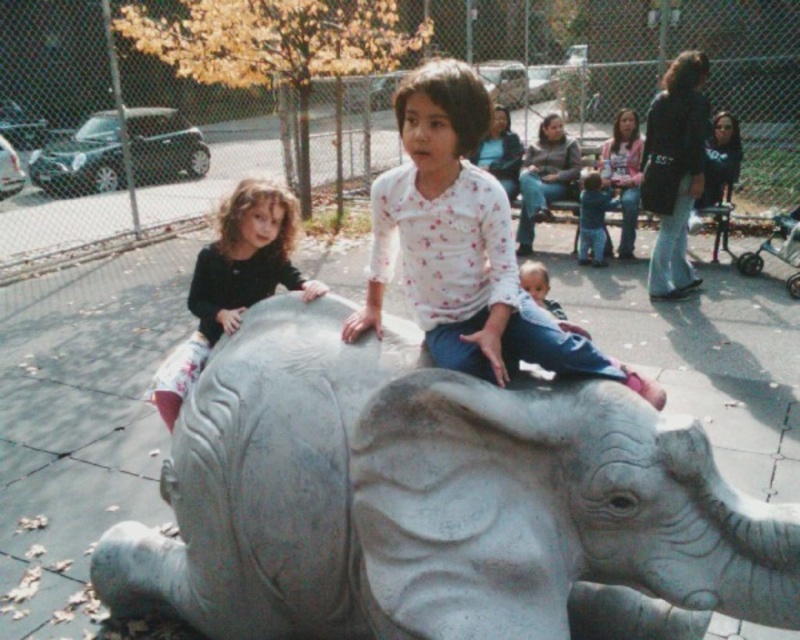
Is gray stone elephant at center below white floral shirt at center?

Yes.

In the scene shown: Can you confirm if gray stone elephant at center is shorter than white floral shirt at center?

No.

Identify the location of gray stone elephant at center. The width and height of the screenshot is (800, 640). (436, 502).

Image resolution: width=800 pixels, height=640 pixels. What do you see at coordinates (436, 502) in the screenshot? I see `gray stone elephant at center` at bounding box center [436, 502].

Can you confirm if gray stone elephant at center is shorter than dark brown hair at left?

No, gray stone elephant at center is not shorter than dark brown hair at left.

Who is more forward, (448, 577) or (284, 189)?

Point (448, 577) is in front.

This screenshot has height=640, width=800. Find the location of `gray stone elephant at center`. gray stone elephant at center is located at coordinates (436, 502).

Between point (458, 225) and point (293, 273), which one is positioned in front?

Point (458, 225) is more forward.

In the scene shown: Does white floral shirt at center have a larger size compared to dark brown hair at left?

Yes.

Between point (454, 163) and point (282, 218), which one is positioned in front?

Positioned in front is point (454, 163).

Identify the location of white floral shirt at center. (462, 244).